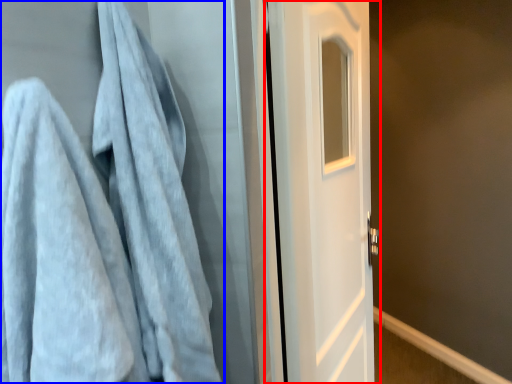
Question: Among these objects, which one is nearest to the camera, door (highlighted by a red box) or towel (highlighted by a blue box)?

Choices:
 (A) door
 (B) towel

Answer: (B)